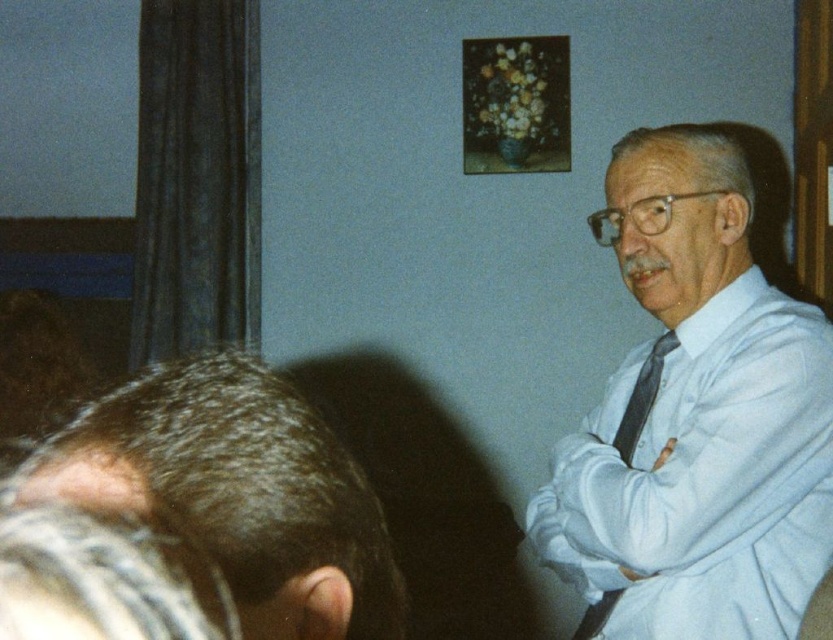
You are an event planner arranging seating for a meeting. You need to place a name tag on the table in front of the dark brown hair at lower left and the black silk tie at right. Which object should you place the name tag closer to based on their positions?

The dark brown hair at lower left is shorter than the black silk tie at right, so the name tag should be placed closer to the dark brown hair at lower left since it is positioned lower.

You are an interior designer observing the scene. You need to determine the relative lengths of the gray hair at lower left and the black silk tie at right. Based on the scene, which object is shorter?

The gray hair at lower left is shorter than the black silk tie at right.